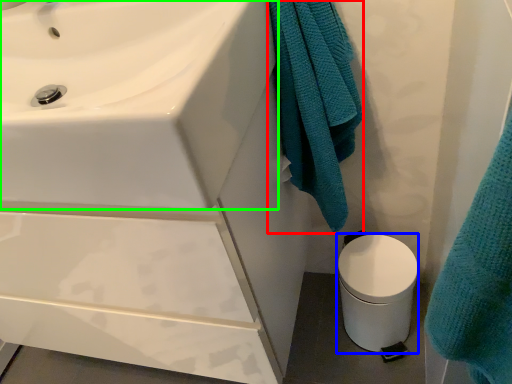
Question: Which object is the closest to the bath towel (highlighted by a red box)? Choose among these: toilet bowl (highlighted by a blue box) or sink (highlighted by a green box).

Choices:
 (A) toilet bowl
 (B) sink

Answer: (B)